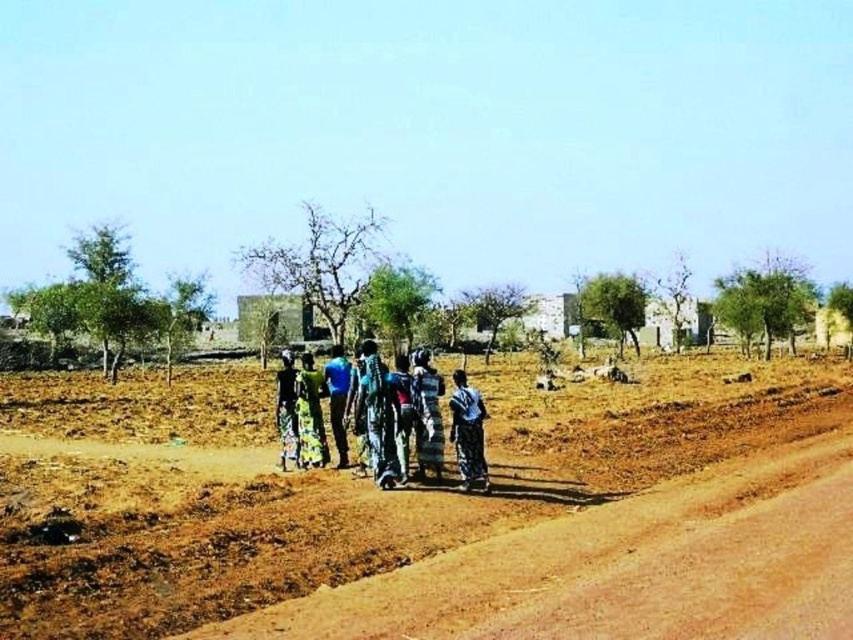
You are a traveler who wants to pack a fabric that is larger than the other. Which fabric should you choose between the multicolored fabric at center and the dark green fabric at center?

The multicolored fabric at center is bigger than the dark green fabric at center, so you should choose the multicolored fabric at center.